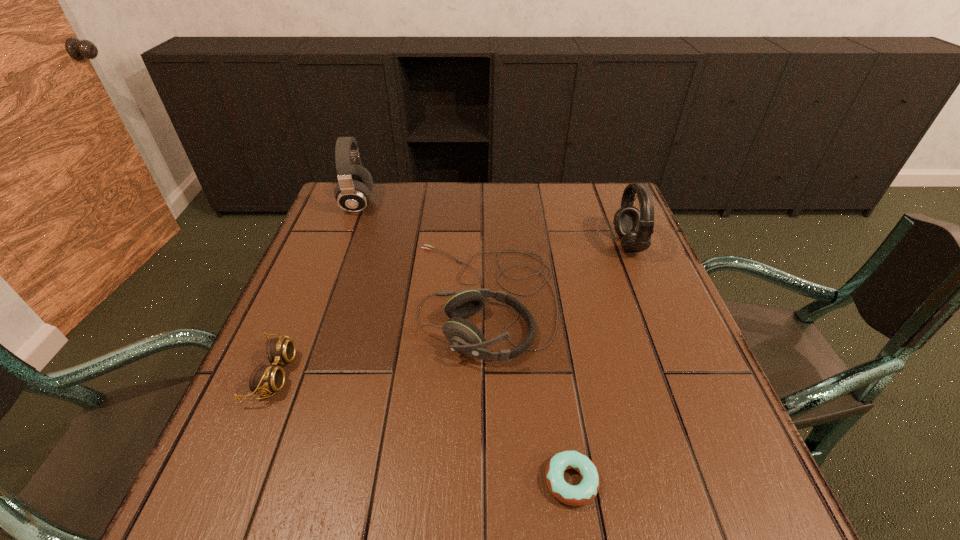
This screenshot has width=960, height=540. I want to click on goggles that is at the left edge, so click(x=265, y=379).

Identify the location of object that is at the right edge. The height and width of the screenshot is (540, 960). (635, 227).

You are a GUI agent. You are given a task and a screenshot of the screen. Output one action in this format:
    pyautogui.click(x=<x>, y=<y>)
    Task: Click on the object that is positioned at the far left corner
    
    Given the screenshot: What is the action you would take?
    pyautogui.click(x=353, y=192)

In order to click on object that is at the far right corner in this screenshot , I will do `click(635, 227)`.

Locate an element on the screen. This screenshot has width=960, height=540. free spot at the far edge of the desktop is located at coordinates (428, 211).

Locate an element on the screen. The width and height of the screenshot is (960, 540). vacant space at the left edge is located at coordinates (329, 232).

This screenshot has height=540, width=960. Identify the location of vacant region at the right edge of the desktop. (587, 238).

I want to click on free spot at the far left corner of the desktop, so click(x=385, y=189).

The width and height of the screenshot is (960, 540). What are the coordinates of `vacant space at the near left corner of the desktop` in the screenshot? It's located at (282, 488).

I want to click on free space between the doughnut and the rightmost object, so click(600, 363).